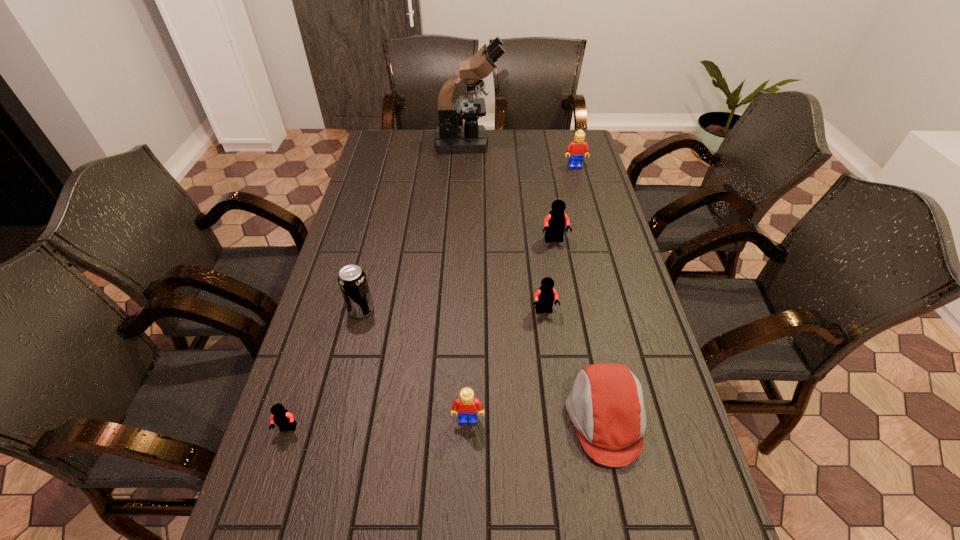
Locate an element on the screen. vacant area that lies between the second farthest black Lego and the leftmost object is located at coordinates (417, 370).

Select which object appears as the third closest to the smaller yellow Lego. Please provide its 2D coordinates. Your answer should be formatted as a tuple, i.e. [(x, y)], where the tuple contains the x and y coordinates of a point satisfying the conditions above.

[(280, 416)]

At what (x,y) coordinates should I click in order to perform the action: click on object that stands as the seventh closest to the third nearest Lego. Please return your answer as a coordinate pair (x, y). Looking at the image, I should click on (451, 137).

Identify which Lego is located as the fourth nearest to the cap. Please provide its 2D coordinates. Your answer should be formatted as a tuple, i.e. [(x, y)], where the tuple contains the x and y coordinates of a point satisfying the conditions above.

[(280, 416)]

Find the location of a particular element. This screenshot has width=960, height=540. Lego that stands as the closest to the biggest black Lego is located at coordinates (544, 298).

In order to click on yellow Lego that is the second closest to the third farthest object in this screenshot , I will do `click(466, 405)`.

Find the location of a particular element. Image resolution: width=960 pixels, height=540 pixels. the second closest yellow Lego to the leftmost object is located at coordinates click(577, 148).

Locate an element on the screen. the closest black Lego to the tallest object is located at coordinates (555, 222).

Identify which black Lego is the nearest to the microscope. Please provide its 2D coordinates. Your answer should be formatted as a tuple, i.e. [(x, y)], where the tuple contains the x and y coordinates of a point satisfying the conditions above.

[(555, 222)]

Find the location of a particular element. This screenshot has height=540, width=960. vacant space that satisfies the following two spatial constraints: 1. on the front-facing side of the rightmost Lego; 2. on the front-facing side of the cap is located at coordinates (643, 418).